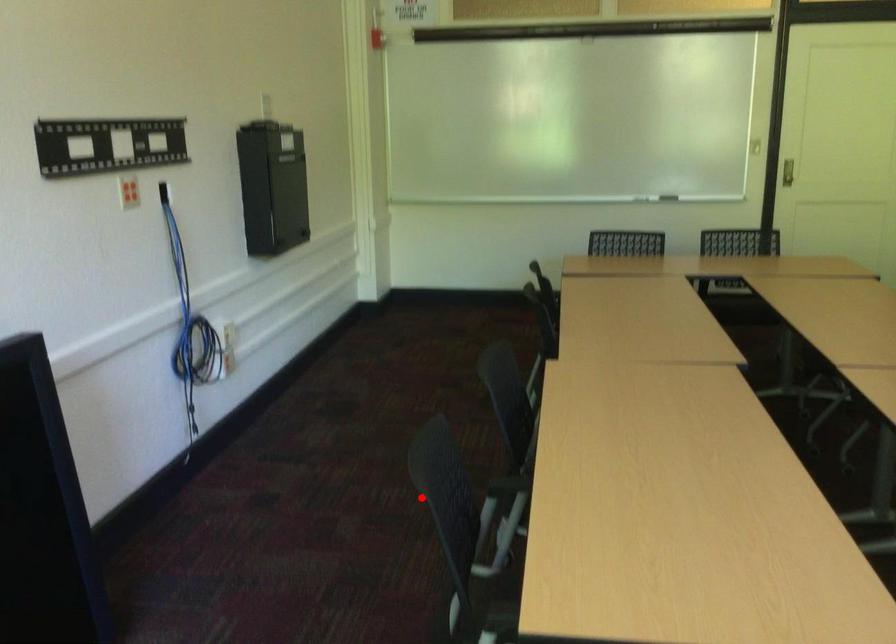
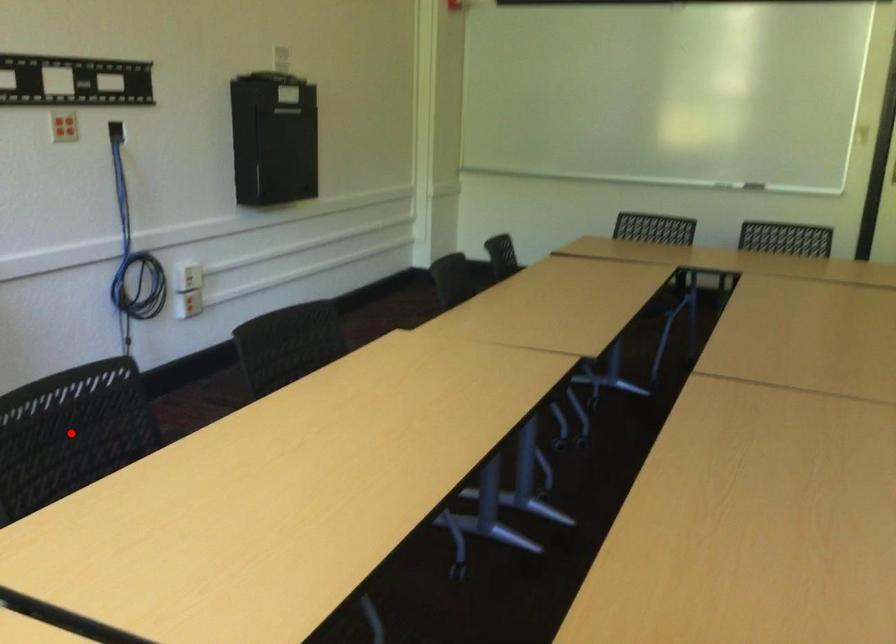
From the picture: I am providing you with two images of the same scene from different viewpoints. A red point is marked on the first image and another point is marked on the second image. Is the marked point in image1 the same physical position as the marked point in image2?

Yes